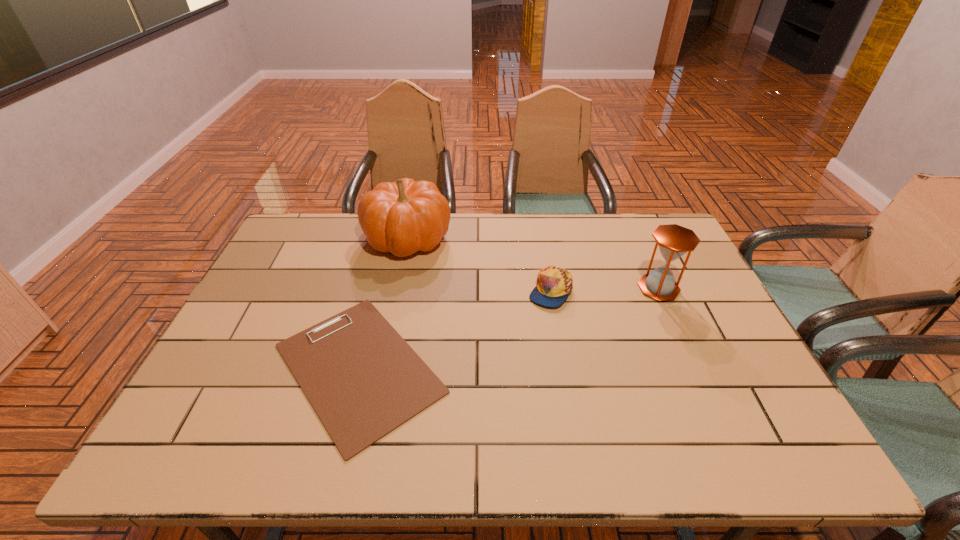
Locate an element on the screen. This screenshot has height=540, width=960. unoccupied position between the hourglass and the cap is located at coordinates (x=604, y=289).

Locate an element on the screen. free space between the shortest object and the rightmost object is located at coordinates (509, 328).

Find the location of a particular element. This screenshot has width=960, height=540. blank region between the clipboard and the farthest object is located at coordinates (383, 303).

Identify the location of vacant area between the third object from left to right and the third shortest object. Image resolution: width=960 pixels, height=540 pixels. (604, 289).

In order to click on vacant space in between the shortest object and the farthest object in this screenshot , I will do `click(383, 303)`.

The width and height of the screenshot is (960, 540). What are the coordinates of `free space between the second tallest object and the third tallest object` in the screenshot? It's located at (604, 289).

The height and width of the screenshot is (540, 960). Find the location of `free space between the farthest object and the shortest object`. free space between the farthest object and the shortest object is located at coordinates (383, 303).

Identify the location of unoccupied area between the shortest object and the cap. The image size is (960, 540). (454, 329).

Image resolution: width=960 pixels, height=540 pixels. Find the location of `vacant region between the shortest object and the third object from left to right`. vacant region between the shortest object and the third object from left to right is located at coordinates (454, 329).

You are a GUI agent. You are given a task and a screenshot of the screen. Output one action in this format:
    pyautogui.click(x=<x>, y=<y>)
    Task: Click on the free space that is in between the rightmost object and the shortest object
    The height and width of the screenshot is (540, 960).
    Given the screenshot: What is the action you would take?
    pyautogui.click(x=509, y=328)